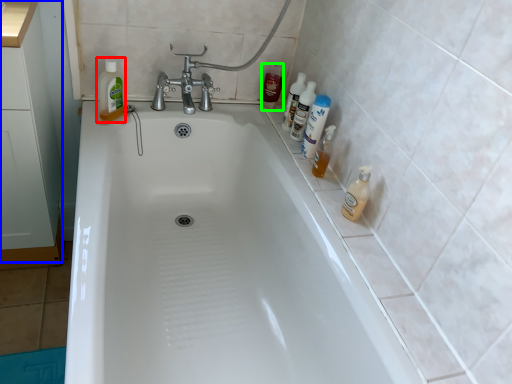
Question: Based on their relative distances, which object is nearer to cleaning product (highlighted by a red box)? Choose from cabinetry (highlighted by a blue box) and toiletry (highlighted by a green box).

Choices:
 (A) cabinetry
 (B) toiletry

Answer: (A)